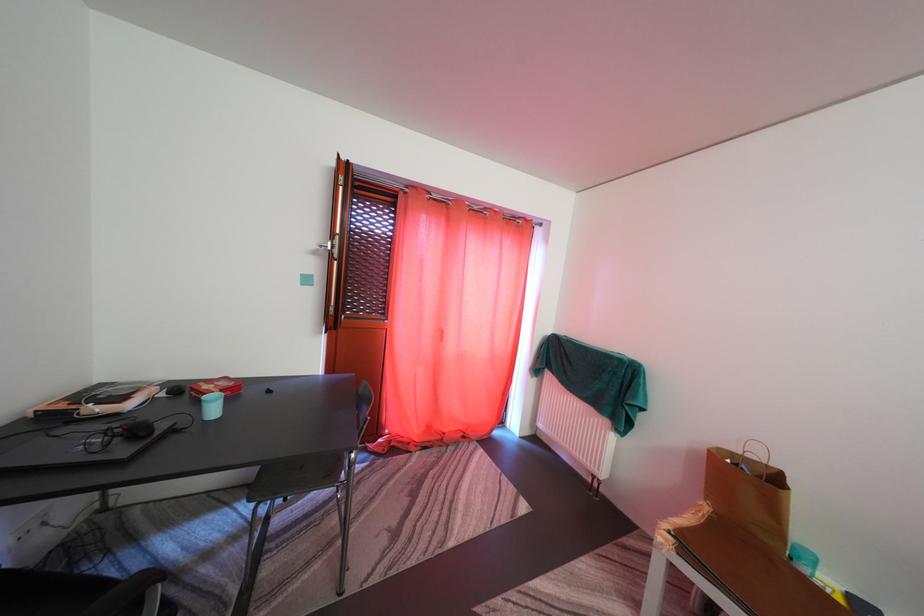
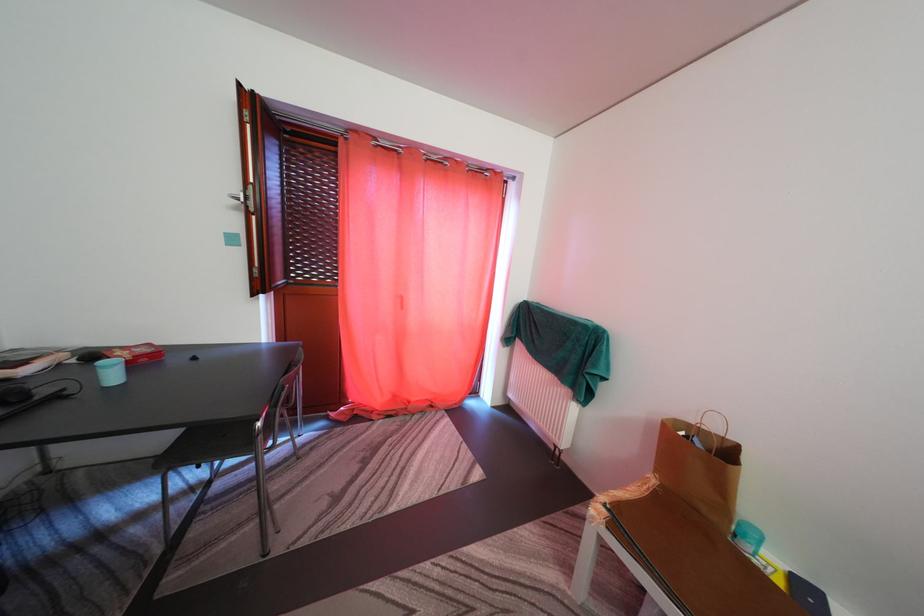
Which direction would the cameraman need to move to produce the second image?

The movement direction of the cameraman is right, forward.